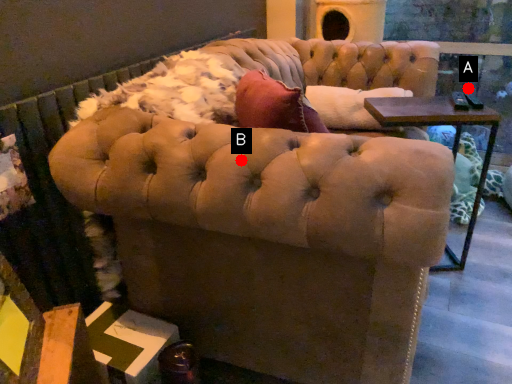
Question: Two points are circled on the image, labeled by A and B beside each circle. Which point appears closest to the camera in this image?

Choices:
 (A) A is closer
 (B) B is closer

Answer: (B)